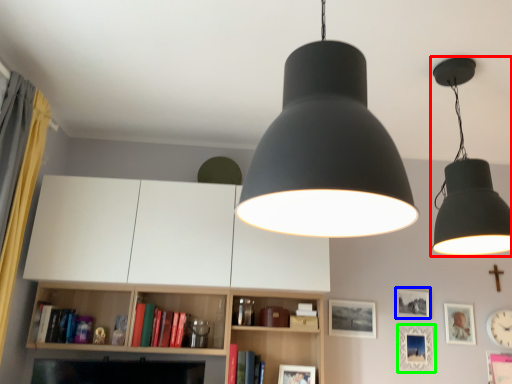
Question: Which is nearer to the lamp (highlighted by a red box)? picture frame (highlighted by a blue box) or picture frame (highlighted by a green box).

Choices:
 (A) picture frame
 (B) picture frame

Answer: (A)